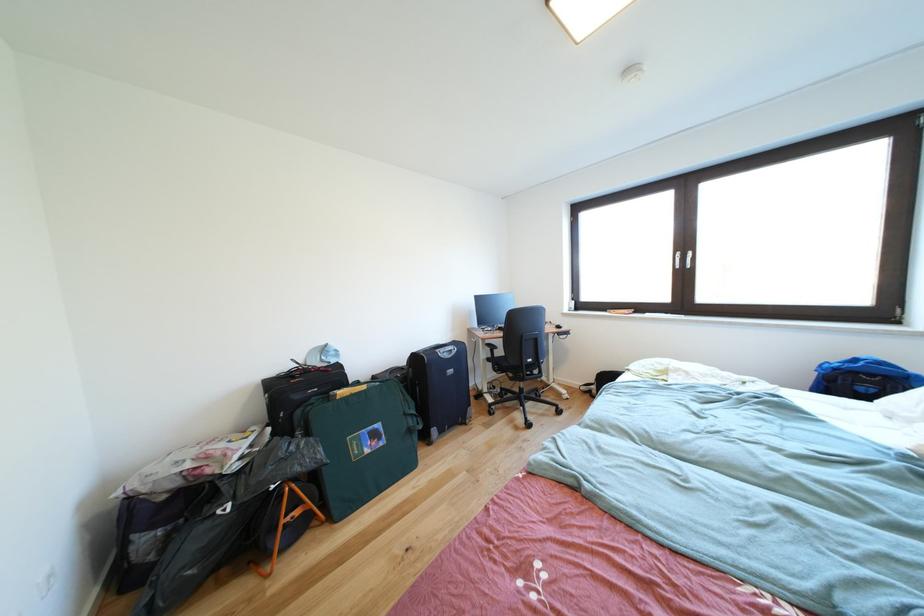
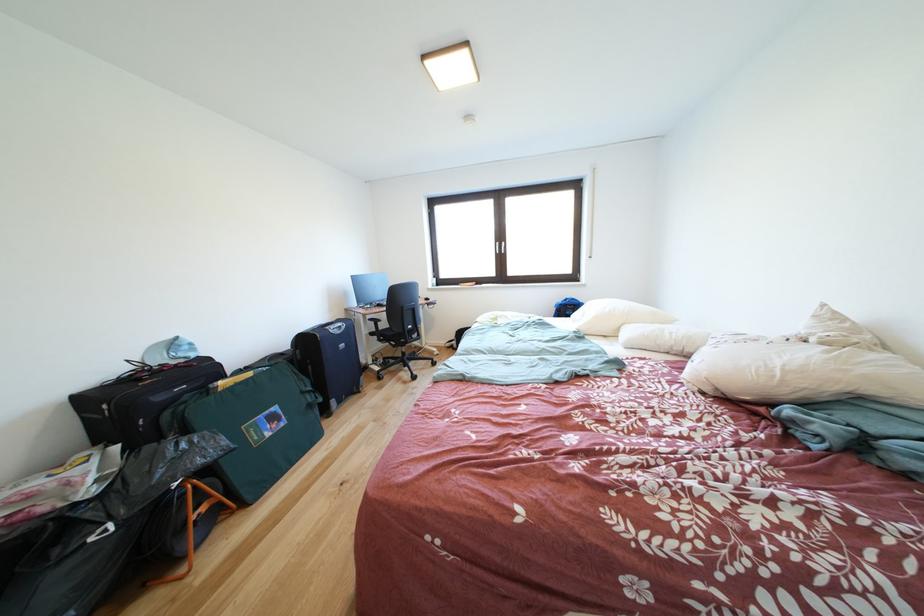
Find the pixel in the second image that matches pixel 519 384 in the first image.

(403, 351)